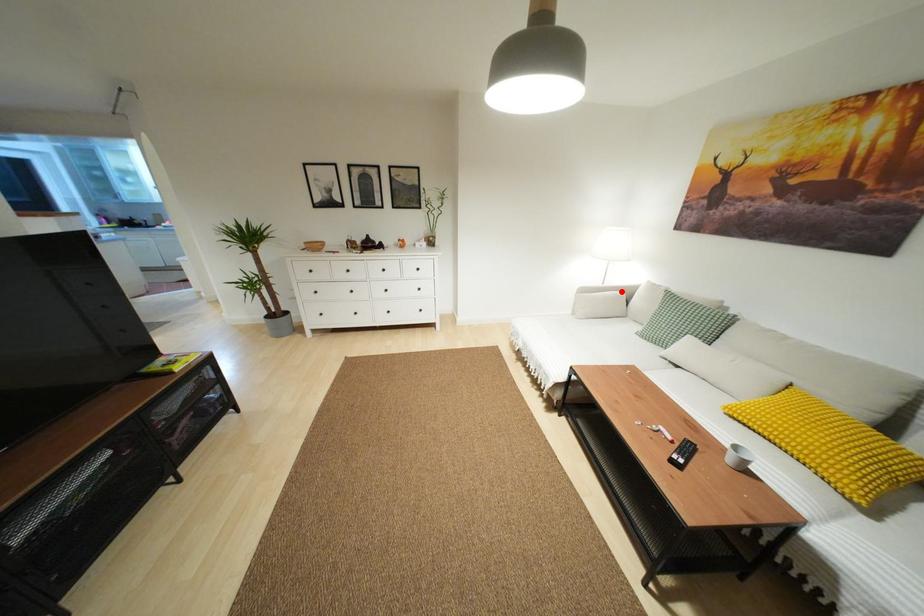
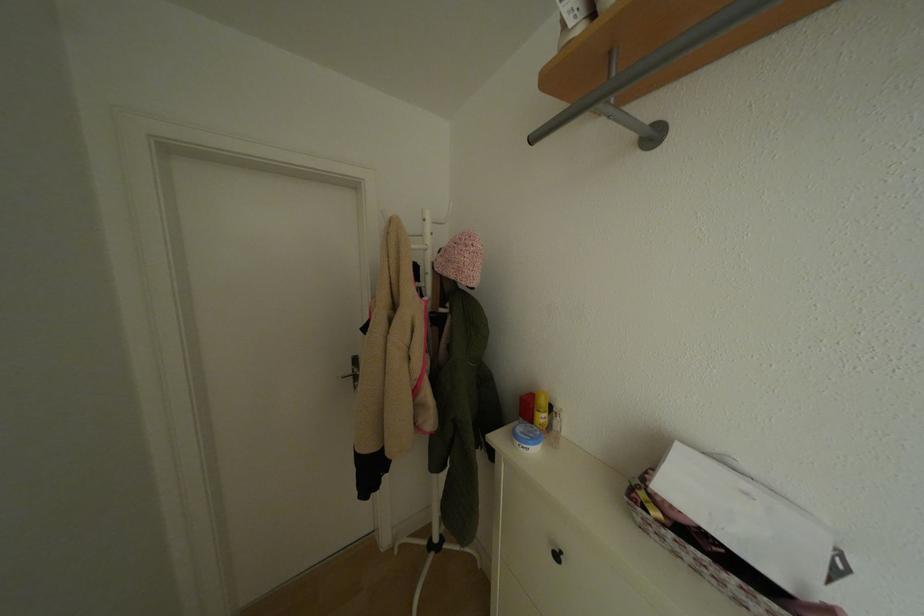
Question: I am providing you with two images of the same scene from different viewpoints. A red point is marked on the first image. At the location where the point appears in image 1, is it still visible in image 2?

Choices:
 (A) Yes
 (B) No

Answer: (B)